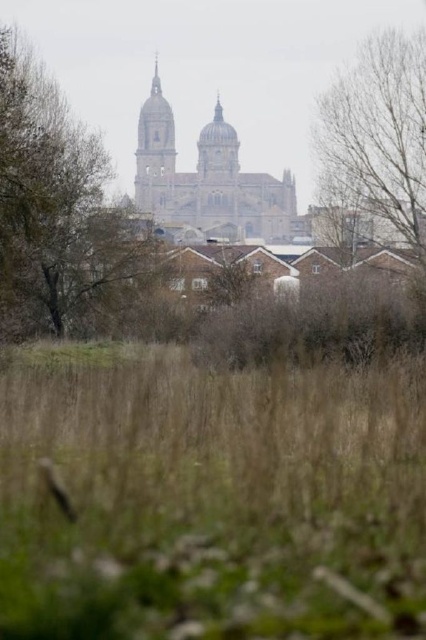
You are standing in the city park and see the brown leafy tree at upper center and the brown stone tower at center. Which object is nearer to you?

The brown leafy tree at upper center is closer to the viewer than the brown stone tower at center.

You are a bird flying at an altitude of 100 feet above the ground. You spot the brown grass at lower center and the bare branches at upper center in your path. Will you be able to fly between them without descending further?

The brown grass at lower center is 112.52 feet away from the bare branches at upper center. Since you are flying at 100 feet, you can safely fly between them without descending because the vertical distance between you and the branches is sufficient.

You are an architect analyzing the cityscape. You need to determine which object has a smaller width between the brown leafy tree at upper center and the brown stone tower at center. Which one is narrower?

The brown leafy tree at upper center has a smaller width compared to the brown stone tower at center, so it is narrower.